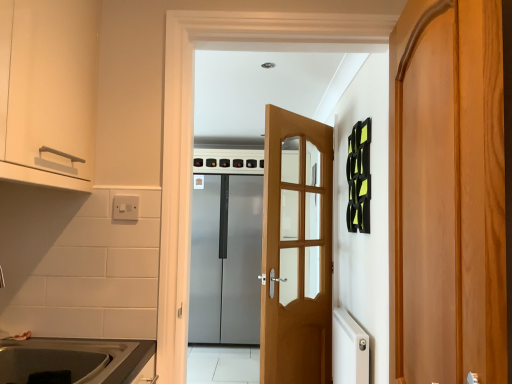
Image resolution: width=512 pixels, height=384 pixels. Describe the element at coordinates (48, 91) in the screenshot. I see `matte white cabinet at upper left` at that location.

Find the location of a particular element. satin silver refrigerator at center, the third door viewed from the right is located at coordinates (226, 261).

The height and width of the screenshot is (384, 512). Find the location of `matte white cabinet at upper left`. matte white cabinet at upper left is located at coordinates (48, 91).

Considering the positions of point (113, 375) and point (6, 178), is point (113, 375) closer or farther from the camera than point (6, 178)?

Point (113, 375) is farther from the camera than point (6, 178).

At what (x,y) coordinates should I click in order to perform the action: click on sink behind the matte white cabinet at upper left. Please return your answer as a coordinate pair (x, y). Looking at the image, I should click on click(68, 359).

From the image's perspective, is matte stainless steel sink at lower left located beneath matte white cabinet at upper left?

Yes, from the image's perspective, matte stainless steel sink at lower left is beneath matte white cabinet at upper left.

Would you say matte stainless steel sink at lower left is a long distance from light brown wooden door at center, the second door positioned from the back?

Yes, matte stainless steel sink at lower left is far from light brown wooden door at center, the second door positioned from the back.

Is matte stainless steel sink at lower left in front of or behind light brown wooden door at center, the second door when ordered from front to back, in the image?

matte stainless steel sink at lower left is in front of light brown wooden door at center, the second door when ordered from front to back.

Measure the distance between matte stainless steel sink at lower left and light brown wooden door at center, which is the 2th door from right to left.

matte stainless steel sink at lower left is 4.66 feet from light brown wooden door at center, which is the 2th door from right to left.

Between satin silver refrigerator at center, positioned as the 1th door in left-to-right order, and light brown wooden door at center, which is the second door from left to right, which one has larger width?

Wider between the two is satin silver refrigerator at center, positioned as the 1th door in left-to-right order.

Is satin silver refrigerator at center, the third door viewed from the right, situated inside light brown wooden door at center, which is the second door from left to right, or outside?

satin silver refrigerator at center, the third door viewed from the right, exists outside the volume of light brown wooden door at center, which is the second door from left to right.

Is satin silver refrigerator at center, the third door viewed from the right, positioned far away from light brown wooden door at center, the second door positioned from the back?

Absolutely, satin silver refrigerator at center, the third door viewed from the right, is distant from light brown wooden door at center, the second door positioned from the back.

From the image's perspective, is satin silver refrigerator at center, the first door when ordered from back to front, under light brown wooden door at center, the second door positioned from the back?

Correct, satin silver refrigerator at center, the first door when ordered from back to front, appears lower than light brown wooden door at center, the second door positioned from the back, in the image.

Is light brown wooden door at center, the second door when ordered from front to back, completely or partially outside of matte stainless steel sink at lower left?

Indeed, light brown wooden door at center, the second door when ordered from front to back, is completely outside matte stainless steel sink at lower left.

Which point is more forward, (281, 162) or (90, 349)?

The point (90, 349) is closer to the camera.

Where is `door that is the 1st object located behind the matte stainless steel sink at lower left`? Image resolution: width=512 pixels, height=384 pixels. door that is the 1st object located behind the matte stainless steel sink at lower left is located at coordinates (296, 250).

Looking at their sizes, would you say matte stainless steel sink at lower left is wider or thinner than white ribbed radiator at lower right?

In the image, matte stainless steel sink at lower left appears to be wider than white ribbed radiator at lower right.

Is white ribbed radiator at lower right inside matte stainless steel sink at lower left?

No, matte stainless steel sink at lower left does not contain white ribbed radiator at lower right.

Is matte stainless steel sink at lower left positioned with its back to white ribbed radiator at lower right?

matte stainless steel sink at lower left is not turned away from white ribbed radiator at lower right.

From a real-world perspective, relative to satin silver refrigerator at center, the first door when ordered from back to front, is matte stainless steel sink at lower left vertically above or below?

Clearly, from a real-world perspective, matte stainless steel sink at lower left is below satin silver refrigerator at center, the first door when ordered from back to front.

Looking at this image, which is behind, matte stainless steel sink at lower left or satin silver refrigerator at center, positioned as the 1th door in left-to-right order?

Positioned behind is satin silver refrigerator at center, positioned as the 1th door in left-to-right order.

Can you tell me how much matte stainless steel sink at lower left and satin silver refrigerator at center, positioned as the 1th door in left-to-right order, differ in facing direction?

matte stainless steel sink at lower left and satin silver refrigerator at center, positioned as the 1th door in left-to-right order, are facing 90.4 degrees away from each other.

Is matte stainless steel sink at lower left surrounding satin silver refrigerator at center, the third door viewed from the right?

No, satin silver refrigerator at center, the third door viewed from the right, is located outside of matte stainless steel sink at lower left.

Does satin silver refrigerator at center, the first door when ordered from back to front, have a smaller size compared to white ribbed radiator at lower right?

Incorrect, satin silver refrigerator at center, the first door when ordered from back to front, is not smaller in size than white ribbed radiator at lower right.

Which is more to the left, satin silver refrigerator at center, arranged as the 3th door when viewed from the front, or white ribbed radiator at lower right?

satin silver refrigerator at center, arranged as the 3th door when viewed from the front.

How distant is satin silver refrigerator at center, arranged as the 3th door when viewed from the front, from white ribbed radiator at lower right?

The distance of satin silver refrigerator at center, arranged as the 3th door when viewed from the front, from white ribbed radiator at lower right is 6.81 feet.

Which of these two, satin silver refrigerator at center, positioned as the 1th door in left-to-right order, or white ribbed radiator at lower right, stands taller?

satin silver refrigerator at center, positioned as the 1th door in left-to-right order, is taller.

Find the location of a particular element. sink below the matte white cabinet at upper left (from the image's perspective) is located at coordinates (68, 359).

Where is `sink in front of the light brown wooden door at center, the second door when ordered from front to back`? sink in front of the light brown wooden door at center, the second door when ordered from front to back is located at coordinates click(x=68, y=359).

Based on their spatial positions, is satin silver refrigerator at center, positioned as the 1th door in left-to-right order, or white ribbed radiator at lower right further from wooden door at right, the first door viewed from the right?

The object further to wooden door at right, the first door viewed from the right, is satin silver refrigerator at center, positioned as the 1th door in left-to-right order.

Which object lies nearer to the anchor point light brown wooden door at center, which is the second door from left to right, wooden door at right, the first door from the front, or satin silver refrigerator at center, arranged as the 3th door when viewed from the front?

Among the two, wooden door at right, the first door from the front, is located nearer to light brown wooden door at center, which is the second door from left to right.

When comparing their distances from matte stainless steel sink at lower left, does light brown wooden door at center, the second door positioned from the back, or wooden door at right, the first door from the front, seem further?

light brown wooden door at center, the second door positioned from the back, is positioned further to the anchor matte stainless steel sink at lower left.

Estimate the real-world distances between objects in this image. Which object is further from light brown wooden door at center, the second door when ordered from front to back, matte white cabinet at upper left or wooden door at right, the 3th door in the left-to-right sequence?

matte white cabinet at upper left is further to light brown wooden door at center, the second door when ordered from front to back.

Based on their spatial positions, is wooden door at right, the first door viewed from the right, or light brown wooden door at center, the second door when ordered from front to back, closer to satin silver refrigerator at center, positioned as the 1th door in left-to-right order?

Based on the image, light brown wooden door at center, the second door when ordered from front to back, appears to be nearer to satin silver refrigerator at center, positioned as the 1th door in left-to-right order.

From the image, which object appears to be farther from matte white cabinet at upper left, white ribbed radiator at lower right or matte stainless steel sink at lower left?

Among the two, white ribbed radiator at lower right is located further to matte white cabinet at upper left.

Looking at this image, estimate the real-world distances between objects in this image. Which object is further from satin silver refrigerator at center, the first door when ordered from back to front, matte white cabinet at upper left or light brown wooden door at center, which is the second door from left to right?

Based on the image, matte white cabinet at upper left appears to be further to satin silver refrigerator at center, the first door when ordered from back to front.

Which object lies further to the anchor point satin silver refrigerator at center, the third door viewed from the right, matte stainless steel sink at lower left or matte white cabinet at upper left?

The object further to satin silver refrigerator at center, the third door viewed from the right, is matte white cabinet at upper left.

Where is `sink between matte white cabinet at upper left and satin silver refrigerator at center, positioned as the 1th door in left-to-right order, in the front-back direction`? Image resolution: width=512 pixels, height=384 pixels. sink between matte white cabinet at upper left and satin silver refrigerator at center, positioned as the 1th door in left-to-right order, in the front-back direction is located at coordinates (68, 359).

Find the location of `appliance located between matte white cabinet at upper left and satin silver refrigerator at center, positioned as the 1th door in left-to-right order, in the depth direction`. appliance located between matte white cabinet at upper left and satin silver refrigerator at center, positioned as the 1th door in left-to-right order, in the depth direction is located at coordinates (349, 349).

Identify the location of door between white ribbed radiator at lower right and satin silver refrigerator at center, positioned as the 1th door in left-to-right order, from front to back. This screenshot has height=384, width=512. (296, 250).

Where is `sink between matte white cabinet at upper left and white ribbed radiator at lower right in the horizontal direction`? The height and width of the screenshot is (384, 512). sink between matte white cabinet at upper left and white ribbed radiator at lower right in the horizontal direction is located at coordinates (68, 359).